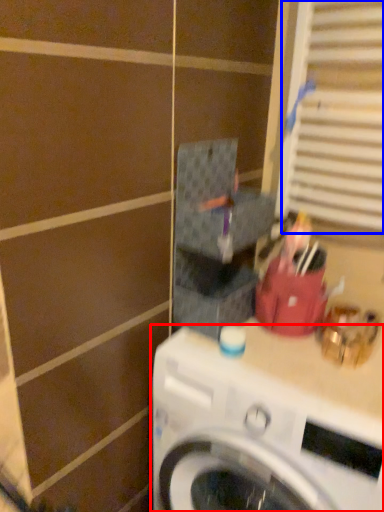
Question: Which of the following is the closest to the observer, washing machine (highlighted by a red box) or window (highlighted by a blue box)?

Choices:
 (A) washing machine
 (B) window

Answer: (A)